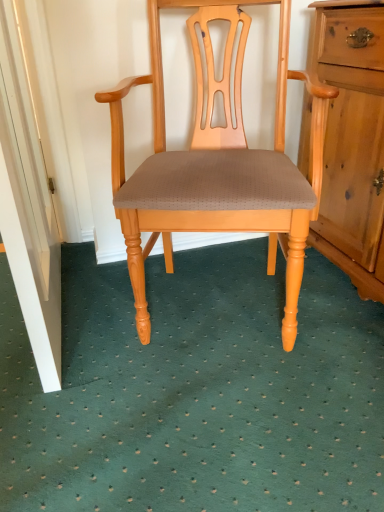
Identify the location of light wood/finely carvedchair at center. This screenshot has height=512, width=384. (217, 177).

What do you see at coordinates (217, 177) in the screenshot?
I see `light wood/finely carvedchair at center` at bounding box center [217, 177].

I want to click on white painted wood door at lower left, so click(28, 207).

Describe the element at coordinates (28, 207) in the screenshot. Image resolution: width=384 pixels, height=512 pixels. I see `white painted wood door at lower left` at that location.

This screenshot has width=384, height=512. What are the coordinates of `light wood/finely carvedchair at center` in the screenshot? It's located at (217, 177).

Which is more to the right, white painted wood door at lower left or light wood/finely carvedchair at center?

Positioned to the right is light wood/finely carvedchair at center.

Does white painted wood door at lower left lie behind light wood/finely carvedchair at center?

No, white painted wood door at lower left is in front of light wood/finely carvedchair at center.

Is point (0, 167) positioned in front of point (275, 234)?

Yes, it is.

From the image's perspective, is white painted wood door at lower left below light wood/finely carvedchair at center?

Actually, white painted wood door at lower left appears above light wood/finely carvedchair at center in the image.

From a real-world perspective, between white painted wood door at lower left and light wood/finely carvedchair at center, who is vertically lower?

In real-world perspective, light wood/finely carvedchair at center is lower.

Considering the sizes of white painted wood door at lower left and light wood/finely carvedchair at center in the image, is white painted wood door at lower left wider or thinner than light wood/finely carvedchair at center?

Considering their sizes, white painted wood door at lower left looks slimmer than light wood/finely carvedchair at center.

Considering the relative sizes of white painted wood door at lower left and light wood/finely carvedchair at center in the image provided, is white painted wood door at lower left taller than light wood/finely carvedchair at center?

Indeed, white painted wood door at lower left has a greater height compared to light wood/finely carvedchair at center.

Looking at the image, does white painted wood door at lower left seem bigger or smaller compared to light wood/finely carvedchair at center?

white painted wood door at lower left is smaller than light wood/finely carvedchair at center.

Could light wood/finely carvedchair at center be considered to be inside white painted wood door at lower left?

No, white painted wood door at lower left does not contain light wood/finely carvedchair at center.

Is white painted wood door at lower left in contact with light wood/finely carvedchair at center?

No, white painted wood door at lower left is not in contact with light wood/finely carvedchair at center.

Is white painted wood door at lower left positioned with its back to light wood/finely carvedchair at center?

Correct, white painted wood door at lower left is looking away from light wood/finely carvedchair at center.

How many degrees apart are the facing directions of white painted wood door at lower left and light wood/finely carvedchair at center?

70.1 degrees.

Locate an element on the screen. The width and height of the screenshot is (384, 512). chair behind the white painted wood door at lower left is located at coordinates (217, 177).

Considering the relative positions of light wood/finely carvedchair at center and white painted wood door at lower left in the image provided, is light wood/finely carvedchair at center to the left of white painted wood door at lower left from the viewer's perspective?

Incorrect, light wood/finely carvedchair at center is not on the left side of white painted wood door at lower left.

Considering their positions, is light wood/finely carvedchair at center located in front of or behind white painted wood door at lower left?

light wood/finely carvedchair at center is positioned farther from the viewer than white painted wood door at lower left.

Considering the points (150, 245) and (44, 284), which point is behind, point (150, 245) or point (44, 284)?

Point (150, 245)

From the image's perspective, is light wood/finely carvedchair at center under white painted wood door at lower left?

Yes.

From a real-world perspective, does light wood/finely carvedchair at center stand above white painted wood door at lower left?

No, from a real-world perspective, light wood/finely carvedchair at center is not over white painted wood door at lower left

Which object is thinner, light wood/finely carvedchair at center or white painted wood door at lower left?

Thinner between the two is white painted wood door at lower left.

Who is shorter, light wood/finely carvedchair at center or white painted wood door at lower left?

light wood/finely carvedchair at center is shorter.

Based on the photo, looking at the image, does light wood/finely carvedchair at center seem bigger or smaller compared to white painted wood door at lower left?

Clearly, light wood/finely carvedchair at center is larger in size than white painted wood door at lower left.

In the scene shown: Is light wood/finely carvedchair at center inside or outside of white painted wood door at lower left?

light wood/finely carvedchair at center cannot be found inside white painted wood door at lower left.

Is light wood/finely carvedchair at center with white painted wood door at lower left?

No, light wood/finely carvedchair at center is not with white painted wood door at lower left.

Is white painted wood door at lower left at the back of light wood/finely carvedchair at center?

No, white painted wood door at lower left is not at the back of light wood/finely carvedchair at center.

How far apart are light wood/finely carvedchair at center and white painted wood door at lower left?

light wood/finely carvedchair at center and white painted wood door at lower left are 15.18 inches apart.

Where is `chair on the right of white painted wood door at lower left`? Image resolution: width=384 pixels, height=512 pixels. chair on the right of white painted wood door at lower left is located at coordinates (217, 177).

Locate an element on the screen. The height and width of the screenshot is (512, 384). chair below the white painted wood door at lower left (from the image's perspective) is located at coordinates (217, 177).

Where is `chair that appears behind the white painted wood door at lower left`? This screenshot has height=512, width=384. chair that appears behind the white painted wood door at lower left is located at coordinates (x=217, y=177).